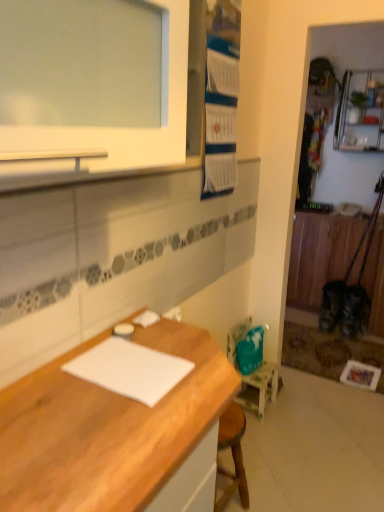
Question: Is teal fabric chair at lower right taller or shorter than white paper at center?

Choices:
 (A) short
 (B) tall

Answer: (B)

Question: Would you say teal fabric chair at lower right is inside or outside white paper at center?

Choices:
 (A) inside
 (B) outside

Answer: (B)

Question: Estimate the real-world distances between objects in this image. Which object is farther from the white paper at center?

Choices:
 (A) wooden desk at lower left
 (B) teal fabric chair at lower right
 (C) wooden cabinet at right
 (D) metallic silver shelf at upper right

Answer: (D)

Question: Which object is positioned farthest from the white paper at center?

Choices:
 (A) wooden cabinet at right
 (B) metallic silver shelf at upper right
 (C) wooden desk at lower left
 (D) teal fabric chair at lower right

Answer: (B)